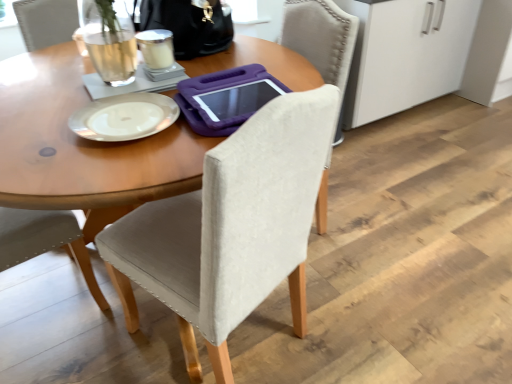
Identify the location of white frosted glass at upper center. The height and width of the screenshot is (384, 512). (157, 49).

This screenshot has width=512, height=384. In order to click on black leather handbag at upper center in this screenshot , I will do `click(189, 25)`.

At what (x,y) coordinates should I click in order to perform the action: click on white glossy plate at upper center. Please return your answer as a coordinate pair (x, y). This screenshot has height=384, width=512. Looking at the image, I should click on (124, 117).

How different are the orientations of black leather handbag at upper center and white frosted glass at upper center in degrees?

The angular difference between black leather handbag at upper center and white frosted glass at upper center is 177 degrees.

Is black leather handbag at upper center in front of or behind white frosted glass at upper center in the image?

Clearly, black leather handbag at upper center is behind white frosted glass at upper center.

From the image's perspective, which one is positioned lower, black leather handbag at upper center or white frosted glass at upper center?

white frosted glass at upper center is shown below in the image.

Identify the location of coffee cup that is on the left side of black leather handbag at upper center. This screenshot has width=512, height=384. (157, 49).

Locate an element on the screen. This screenshot has width=512, height=384. plate lying below the black leather handbag at upper center (from the image's perspective) is located at coordinates (124, 117).

Is black leather handbag at upper center looking in the opposite direction of white glossy plate at upper center?

That's not correct — black leather handbag at upper center is not looking away from white glossy plate at upper center.

Who is smaller, black leather handbag at upper center or white glossy plate at upper center?

white glossy plate at upper center is smaller.

From the image's perspective, is black leather handbag at upper center positioned above or below white glossy plate at upper center?

black leather handbag at upper center is above white glossy plate at upper center.

Considering the sizes of white frosted glass at upper center and beige fabric chair at center in the image, is white frosted glass at upper center bigger or smaller than beige fabric chair at center?

In the image, white frosted glass at upper center appears to be smaller than beige fabric chair at center.

Identify the location of chair that is below the white frosted glass at upper center (from the image's perspective). (230, 228).

Is white frosted glass at upper center looking in the opposite direction of beige fabric chair at center?

No, white frosted glass at upper center is not facing away from beige fabric chair at center.

Can we say white frosted glass at upper center lies outside beige fabric chair at center?

That's correct, white frosted glass at upper center is outside of beige fabric chair at center.

How many degrees apart are the facing directions of black leather handbag at upper center and beige fabric chair at center?

The angular difference between black leather handbag at upper center and beige fabric chair at center is 64.4 degrees.

Which of these two, black leather handbag at upper center or beige fabric chair at center, is bigger?

beige fabric chair at center is bigger.

Is black leather handbag at upper center wider or thinner than beige fabric chair at center?

Considering their sizes, black leather handbag at upper center looks slimmer than beige fabric chair at center.

Which object is positioned more to the right, black leather handbag at upper center or beige fabric chair at center?

beige fabric chair at center is more to the right.

Which is farther from the camera, [185,284] or [149,4]?

The point [149,4] is farther from the camera.

From the image's perspective, is beige fabric chair at center below black leather handbag at upper center?

Yes.

Does beige fabric chair at center appear on the left side of black leather handbag at upper center?

No.

How different are the orientations of beige fabric chair at center and black leather handbag at upper center in degrees?

The facing directions of beige fabric chair at center and black leather handbag at upper center are 64.4 degrees apart.

Can you confirm if beige fabric chair at center is shorter than white glossy plate at upper center?

Incorrect, the height of beige fabric chair at center does not fall short of that of white glossy plate at upper center.

Does beige fabric chair at center turn towards white glossy plate at upper center?

Yes, beige fabric chair at center faces towards white glossy plate at upper center.

From the image's perspective, who appears lower, beige fabric chair at center or white glossy plate at upper center?

beige fabric chair at center, from the image's perspective.

Are white frosted glass at upper center and white glossy plate at upper center far apart?

No.

Considering the sizes of objects white frosted glass at upper center and white glossy plate at upper center in the image provided, who is thinner, white frosted glass at upper center or white glossy plate at upper center?

white frosted glass at upper center.

From a real-world perspective, between white frosted glass at upper center and white glossy plate at upper center, who is vertically lower?

In real-world perspective, white glossy plate at upper center is lower.

Identify the location of handbag lying above the white frosted glass at upper center (from the image's perspective). The height and width of the screenshot is (384, 512). (189, 25).

At what (x,y) coordinates should I click in order to perform the action: click on plate on the left of the black leather handbag at upper center. Please return your answer as a coordinate pair (x, y). The image size is (512, 384). Looking at the image, I should click on (124, 117).

When comparing their distances from white glossy plate at upper center, does black leather handbag at upper center or white frosted glass at upper center seem closer?

white frosted glass at upper center is closer to white glossy plate at upper center.

Looking at the image, which one is located further to white glossy plate at upper center, white frosted glass at upper center or beige fabric chair at center?

beige fabric chair at center lies further to white glossy plate at upper center than the other object.

Estimate the real-world distances between objects in this image. Which object is closer to beige fabric chair at center, black leather handbag at upper center or white glossy plate at upper center?

white glossy plate at upper center is closer to beige fabric chair at center.

Considering their positions, is white glossy plate at upper center positioned further to black leather handbag at upper center than beige fabric chair at center?

beige fabric chair at center lies further to black leather handbag at upper center than the other object.

Estimate the real-world distances between objects in this image. Which object is closer to white frosted glass at upper center, white glossy plate at upper center or beige fabric chair at center?

white glossy plate at upper center.

Considering their positions, is black leather handbag at upper center positioned closer to beige fabric chair at center than white frosted glass at upper center?

white frosted glass at upper center is closer to beige fabric chair at center.

From the image, which object appears to be farther from white frosted glass at upper center, white glossy plate at upper center or black leather handbag at upper center?

white glossy plate at upper center is further to white frosted glass at upper center.

Considering their positions, is beige fabric chair at center positioned further to black leather handbag at upper center than white frosted glass at upper center?

beige fabric chair at center.

You are a GUI agent. You are given a task and a screenshot of the screen. Output one action in this format:
    pyautogui.click(x=<x>, y=<y>)
    Task: Click on the coffee cup between black leather handbag at upper center and white glossy plate at upper center from top to bottom
    This screenshot has height=384, width=512.
    Given the screenshot: What is the action you would take?
    pyautogui.click(x=157, y=49)

You are a GUI agent. You are given a task and a screenshot of the screen. Output one action in this format:
    pyautogui.click(x=<x>, y=<y>)
    Task: Click on the plate between black leather handbag at upper center and beige fabric chair at center in the up-down direction
    
    Given the screenshot: What is the action you would take?
    pyautogui.click(x=124, y=117)

Locate an element on the screen. The width and height of the screenshot is (512, 384). plate between beige fabric chair at center and white frosted glass at upper center along the z-axis is located at coordinates (124, 117).

In order to click on coffee cup that lies between black leather handbag at upper center and beige fabric chair at center from top to bottom in this screenshot , I will do `click(157, 49)`.